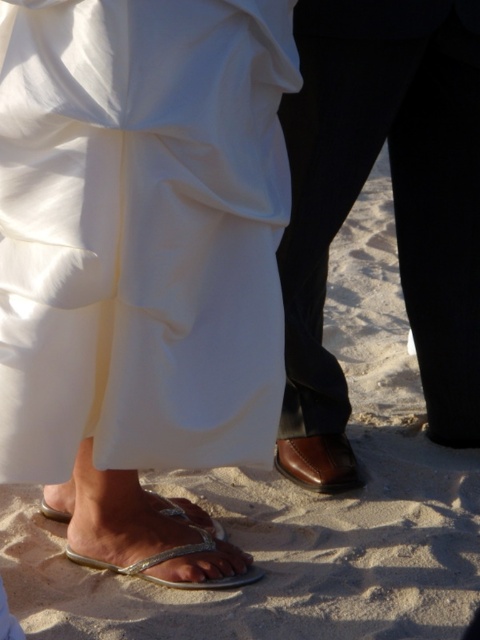
Which is in front, point (31, 26) or point (342, 440)?

Point (31, 26) is more forward.

Does white satin dress at center have a lesser width compared to brown leather shoe at center?

Incorrect, white satin dress at center's width is not less than brown leather shoe at center's.

Is point (107, 109) closer to viewer compared to point (348, 474)?

Yes, point (107, 109) is in front of point (348, 474).

The height and width of the screenshot is (640, 480). Identify the location of white satin dress at center. (142, 230).

Does white satin dress at center appear on the right side of brown leather shoes at lower center?

Incorrect, white satin dress at center is not on the right side of brown leather shoes at lower center.

Who is shorter, white satin dress at center or brown leather shoes at lower center?

white satin dress at center

Is point (110, 324) more distant than point (419, 218)?

No, it is in front of (419, 218).

What are the coordinates of `white satin dress at center` in the screenshot? It's located at (142, 230).

Between brown leather shoe at center and white leather sandal at lower left, which one has more height?

white leather sandal at lower left

Is brown leather shoe at center thinner than white leather sandal at lower left?

Yes, brown leather shoe at center is thinner than white leather sandal at lower left.

Is point (339, 464) in front of point (68, 557)?

No, (339, 464) is further to viewer.

The width and height of the screenshot is (480, 640). I want to click on brown leather shoe at center, so click(320, 461).